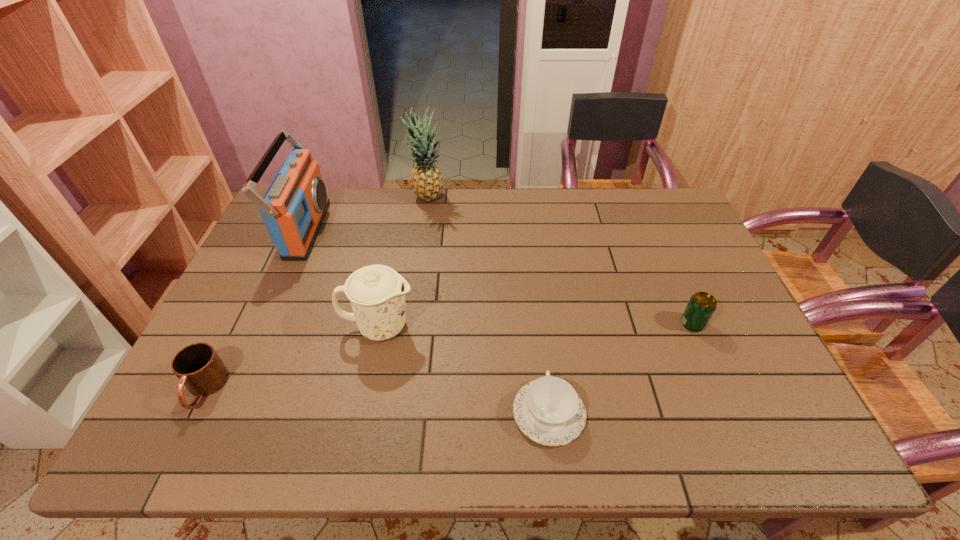
Where is `object that is the closest to the shorter chinaware`? object that is the closest to the shorter chinaware is located at coordinates (377, 293).

This screenshot has height=540, width=960. Find the location of `blank area in the image that satisfies the following two spatial constraints: 1. on the spout of the left chinaware; 2. on the handle side of the right chinaware`. blank area in the image that satisfies the following two spatial constraints: 1. on the spout of the left chinaware; 2. on the handle side of the right chinaware is located at coordinates (361, 414).

The height and width of the screenshot is (540, 960). Find the location of `free space that satisfies the following two spatial constraints: 1. on the front-facing side of the radio receiver; 2. on the side of the mug with the handle`. free space that satisfies the following two spatial constraints: 1. on the front-facing side of the radio receiver; 2. on the side of the mug with the handle is located at coordinates (235, 389).

Where is `free space that satisfies the following two spatial constraints: 1. on the handle side of the shorter chinaware; 2. on the spout of the third tallest object`? free space that satisfies the following two spatial constraints: 1. on the handle side of the shorter chinaware; 2. on the spout of the third tallest object is located at coordinates (539, 327).

Where is `vacant region that satisfies the following two spatial constraints: 1. on the handle side of the nearer chinaware; 2. on the spout of the farther chinaware`? vacant region that satisfies the following two spatial constraints: 1. on the handle side of the nearer chinaware; 2. on the spout of the farther chinaware is located at coordinates (539, 327).

Locate an element on the screen. The height and width of the screenshot is (540, 960). vacant space that satisfies the following two spatial constraints: 1. on the front-facing side of the fifth shortest object; 2. on the right side of the beer can is located at coordinates (264, 324).